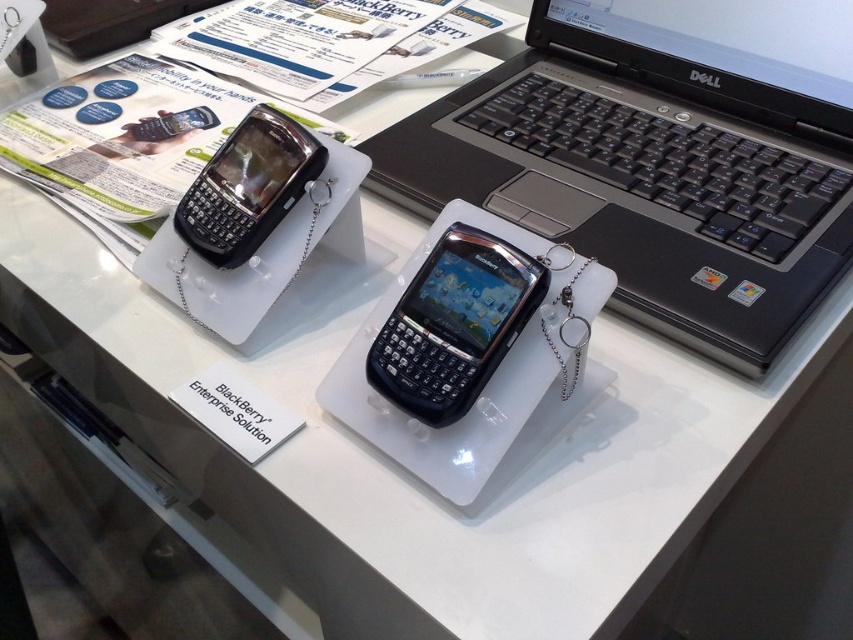
Does black glossy smartphone at center have a greater height compared to black glossy phone at center?

No, black glossy smartphone at center is not taller than black glossy phone at center.

Who is more forward, (x=380, y=371) or (x=218, y=198)?

Point (x=380, y=371) is more forward.

The height and width of the screenshot is (640, 853). What are the coordinates of `black glossy smartphone at center` in the screenshot? It's located at (454, 324).

Describe the element at coordinates (660, 156) in the screenshot. This screenshot has width=853, height=640. I see `black matte laptop at center` at that location.

In the scene shown: Who is more forward, (589,29) or (418,339)?

Point (418,339) is more forward.

Which is behind, point (563, 154) or point (532, 262)?

Point (563, 154)

The height and width of the screenshot is (640, 853). I want to click on black matte laptop at center, so click(660, 156).

Is black matte laptop at center further to the viewer compared to black glossy phone at center?

No, black matte laptop at center is closer to the viewer.

Can you confirm if black matte laptop at center is taller than black glossy phone at center?

Yes.

Where is `black matte laptop at center`? black matte laptop at center is located at coordinates (660, 156).